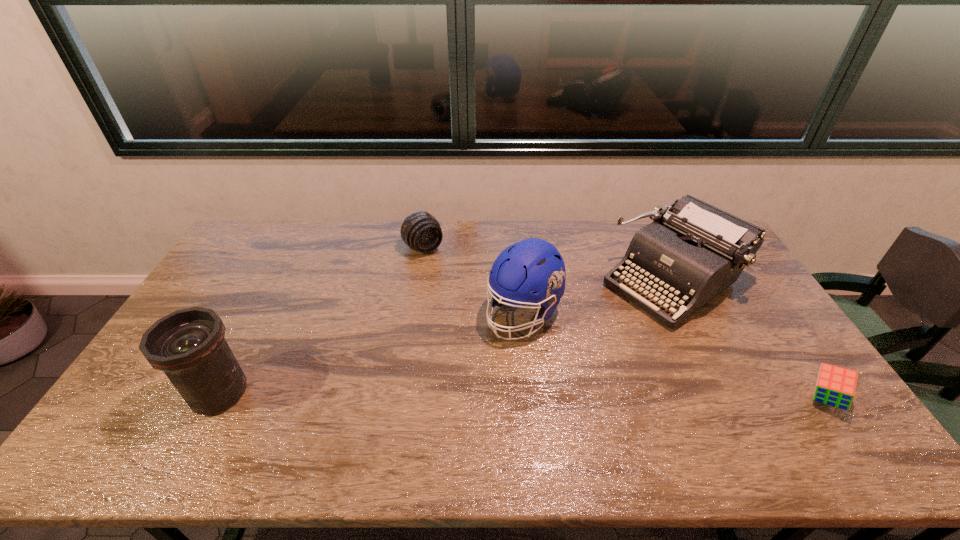
Find the location of a particular element. vacant space that's between the football helmet and the shorter telephoto lens is located at coordinates pos(473,281).

Where is `the second closest object to the fourth tallest object`? This screenshot has width=960, height=540. the second closest object to the fourth tallest object is located at coordinates (692, 251).

The image size is (960, 540). What are the coordinates of `the second closest object to the leftmost object` in the screenshot? It's located at (533, 264).

Locate an element on the screen. The width and height of the screenshot is (960, 540). free space that satisfies the following two spatial constraints: 1. on the front side of the farther telephoto lens; 2. on the left side of the typewriter is located at coordinates (419, 281).

Where is `free point that satisfies the following two spatial constraints: 1. on the front side of the right telephoto lens; 2. on the left side of the third object from right to left`? free point that satisfies the following two spatial constraints: 1. on the front side of the right telephoto lens; 2. on the left side of the third object from right to left is located at coordinates (413, 313).